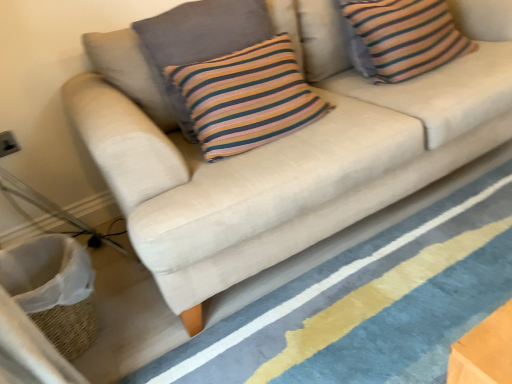
Question: From the image's perspective, is beige fabric sofa at lower center over knitted cotton pillow at center, the 2th pillow in the right-to-left sequence?

Choices:
 (A) no
 (B) yes

Answer: (A)

Question: Considering the relative sizes of beige fabric sofa at lower center and knitted cotton pillow at center, marked as the first pillow in a left-to-right arrangement, in the image provided, is beige fabric sofa at lower center thinner than knitted cotton pillow at center, marked as the first pillow in a left-to-right arrangement,?

Choices:
 (A) yes
 (B) no

Answer: (B)

Question: Is beige fabric sofa at lower center not close to knitted cotton pillow at center, marked as the first pillow in a left-to-right arrangement?

Choices:
 (A) yes
 (B) no

Answer: (B)

Question: Does beige fabric sofa at lower center have a larger size compared to knitted cotton pillow at center, the 2th pillow in the right-to-left sequence?

Choices:
 (A) yes
 (B) no

Answer: (A)

Question: Can you confirm if beige fabric sofa at lower center is shorter than knitted cotton pillow at center, marked as the first pillow in a left-to-right arrangement?

Choices:
 (A) yes
 (B) no

Answer: (A)

Question: From the image's perspective, is white woven basket at lower left positioned above or below knitted cotton pillow at center, the 2th pillow in the right-to-left sequence?

Choices:
 (A) below
 (B) above

Answer: (A)

Question: Relative to knitted cotton pillow at center, the 2th pillow in the right-to-left sequence, is white woven basket at lower left in front or behind?

Choices:
 (A) front
 (B) behind

Answer: (A)

Question: Choose the correct answer: Is white woven basket at lower left inside knitted cotton pillow at center, marked as the first pillow in a left-to-right arrangement, or outside it?

Choices:
 (A) inside
 (B) outside

Answer: (B)

Question: Is white woven basket at lower left bigger or smaller than knitted cotton pillow at center, the 2th pillow in the right-to-left sequence?

Choices:
 (A) small
 (B) big

Answer: (B)

Question: Is beige fabric sofa at lower center in front of or behind white woven basket at lower left in the image?

Choices:
 (A) behind
 (B) front

Answer: (B)

Question: From the image's perspective, is beige fabric sofa at lower center positioned above or below white woven basket at lower left?

Choices:
 (A) below
 (B) above

Answer: (B)

Question: Considering the positions of point (439, 291) and point (87, 326), is point (439, 291) closer or farther from the camera than point (87, 326)?

Choices:
 (A) farther
 (B) closer

Answer: (B)

Question: Based on their positions, is beige fabric sofa at lower center located to the left or right of white woven basket at lower left?

Choices:
 (A) left
 (B) right

Answer: (B)

Question: From a real-world perspective, is white woven basket at lower left positioned above or below beige fabric sofa at lower center?

Choices:
 (A) above
 (B) below

Answer: (A)

Question: Considering the positions of white woven basket at lower left and beige fabric sofa at lower center in the image, is white woven basket at lower left bigger or smaller than beige fabric sofa at lower center?

Choices:
 (A) small
 (B) big

Answer: (A)